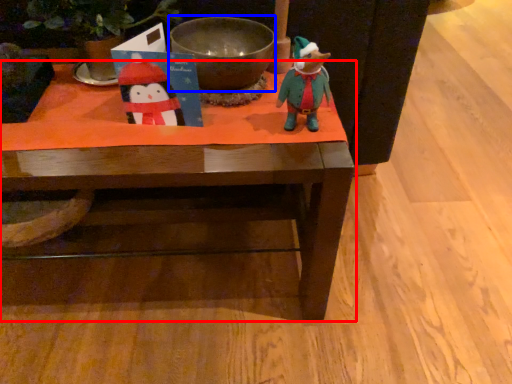
Question: Among these objects, which one is farthest to the camera, table (highlighted by a red box) or bowl (highlighted by a blue box)?

Choices:
 (A) table
 (B) bowl

Answer: (B)